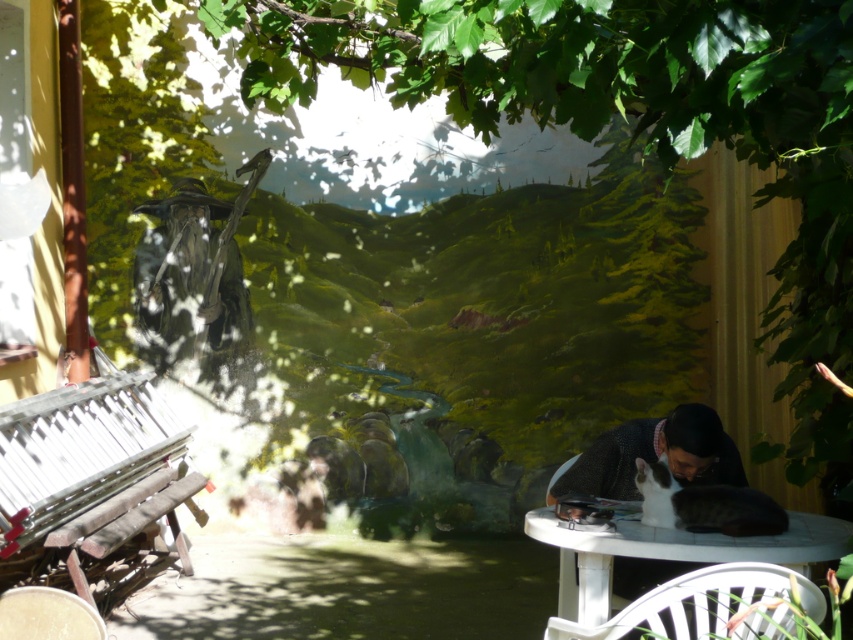
You are a person sitting on the white plastic chair at lower right and want to reach the white plastic table at lower right to grab a drink. Is the table within easy reach from the chair?

The distance between the white plastic table at lower right and the white plastic chair at lower right is 14.48 inches, which is a short distance. Therefore, the table is within easy reach from the chair.

You are a person who is 1.8 meters tall and standing in the scene. You want to sit down comfortably on the white plastic chair at lower right while keeping your feet on the ground. Based on the scene description, can you determine if the height of the white plastic table at lower right is suitable for your legs to comfortably reach the ground when sitting?

The white plastic table at lower right has a lesser height compared to the white plastic chair at lower right. Since the table is shorter than the chair, the chair is taller, meaning when you sit on the white plastic chair at lower right, your feet should comfortably reach the ground as the chair height is appropriate for your leg length.

You are planning to place a new rectangular plant pot that is 1 meter wide on the patio. The plant pot needs to fit entirely on the white plastic table at lower right. Given that the white plastic chair at lower right is currently placed next to the table, can you determine if the table is wide enough to accommodate the plant pot without overlapping the chair?

The white plastic table at lower right might be wider than the white plastic chair at lower right. However, since the chair is next to the table, the table must be at least as wide as the chair to accommodate the plant pot. Since the table might be wider, there is a possibility it can fit the 1m wide plant pot, but this depends on the exact width difference between the table and chair.